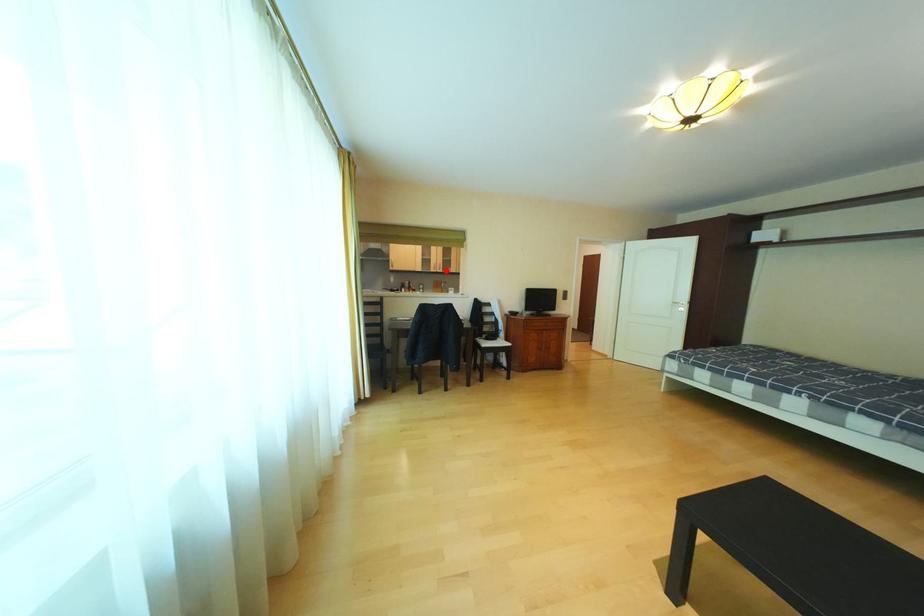
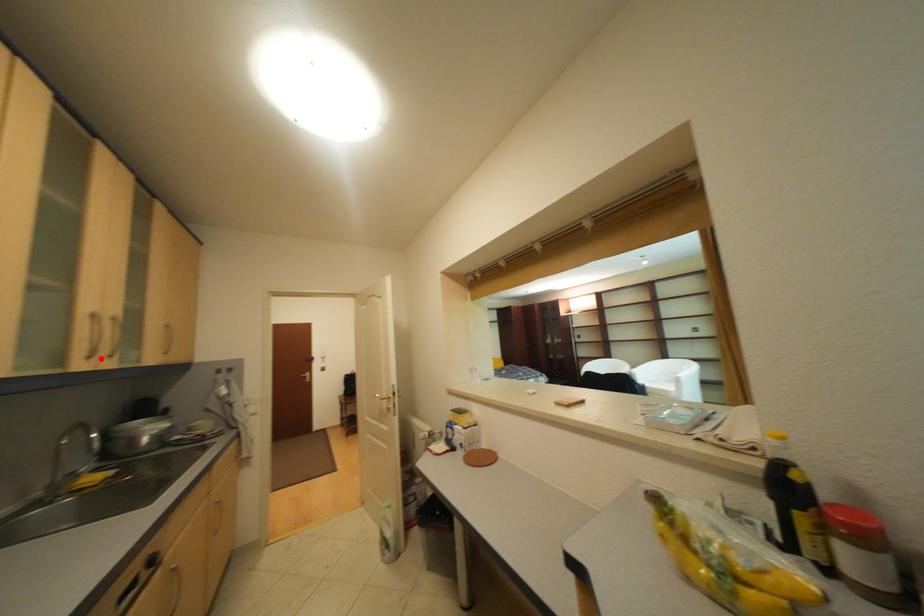
I am providing you with two images of the same scene from different viewpoints. A red point is marked on the first image and another point is marked on the second image. Does the point marked in image1 correspond to the same location as the one in image2?

Yes